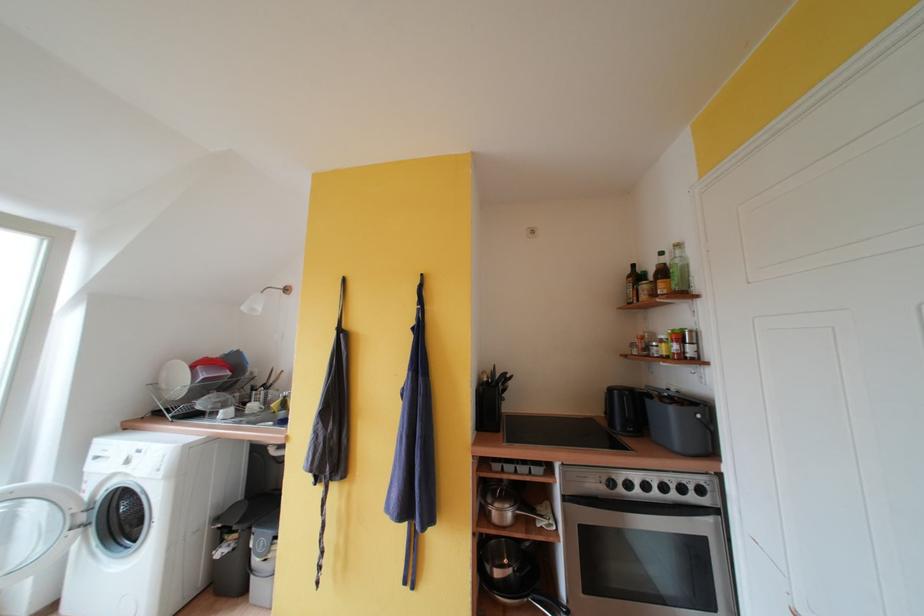
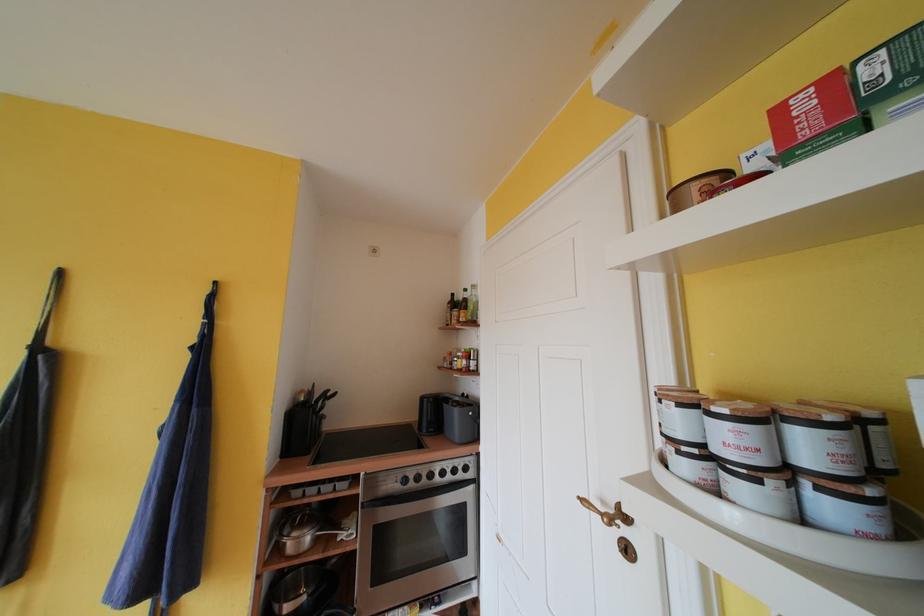
Question: I am providing you with two images of the same scene from different viewpoints. After the viewpoint changes to image2, which objects are now occluded?

Choices:
 (A) red cardboard box
 (B) black knife handle
 (C) pot handle
 (D) none of these

Answer: (D)